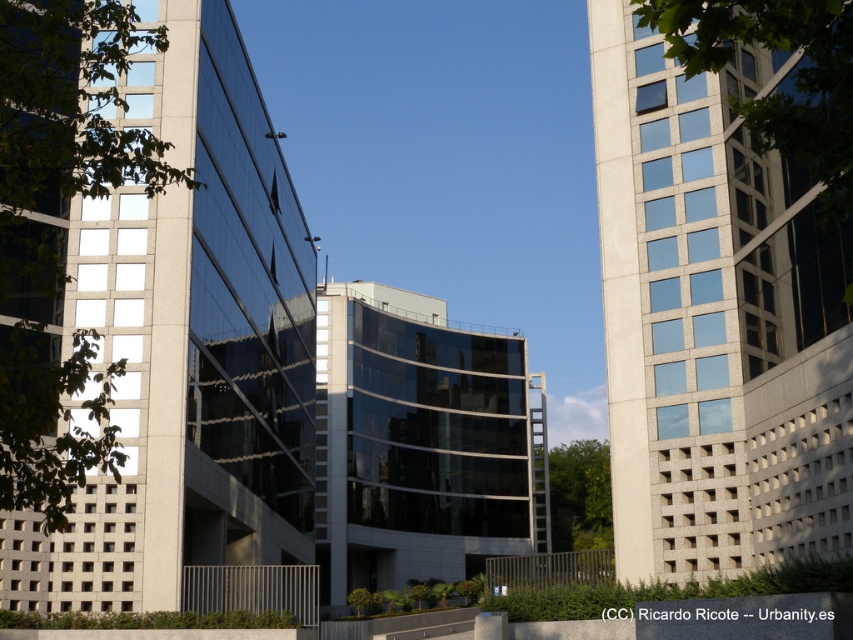
Question: Can you confirm if matte glass building at center is positioned to the left of white textured building at right?

Choices:
 (A) yes
 (B) no

Answer: (A)

Question: Among these points, which one is nearest to the camera?

Choices:
 (A) (637, 540)
 (B) (502, 412)
 (C) (216, 147)

Answer: (A)

Question: Estimate the real-world distances between objects in this image. Which object is farther from the glossy glass building at center?

Choices:
 (A) matte glass building at center
 (B) white textured building at right

Answer: (B)

Question: Observing the image, what is the correct spatial positioning of matte glass building at center in reference to glossy glass building at center?

Choices:
 (A) left
 (B) right

Answer: (A)

Question: Is matte glass building at center to the right of white textured building at right from the viewer's perspective?

Choices:
 (A) no
 (B) yes

Answer: (A)

Question: Which object appears farthest from the camera in this image?

Choices:
 (A) matte glass building at center
 (B) glossy glass building at center
 (C) white textured building at right

Answer: (B)